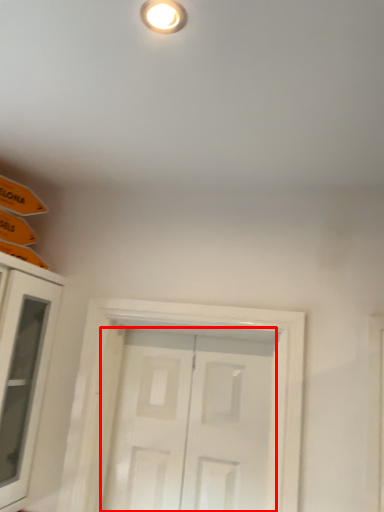
Question: Considering the relative positions of door (annotated by the red box) and cabinetry in the image provided, where is door (annotated by the red box) located with respect to the staircase?

Choices:
 (A) left
 (B) right

Answer: (B)